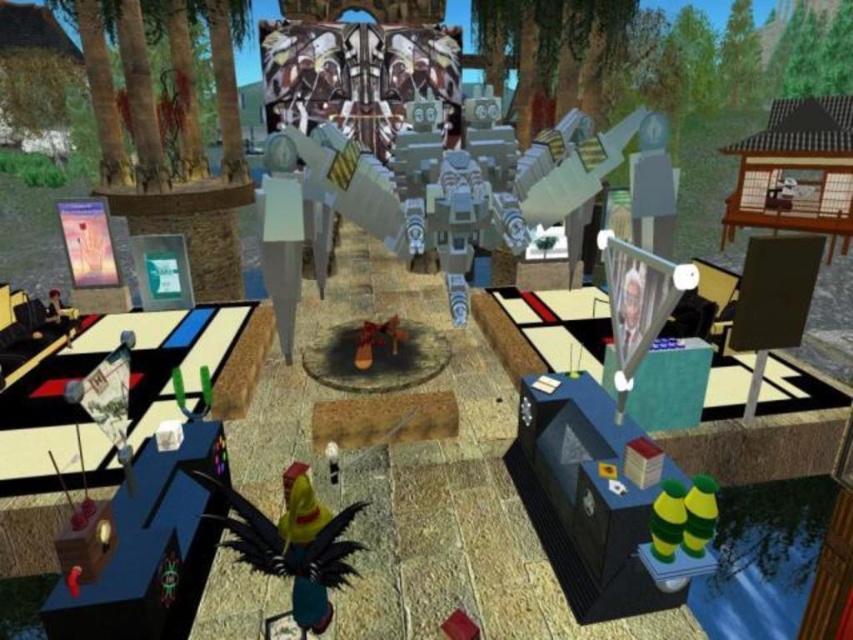
Question: Which is farther from the shiny yellow toy at center?

Choices:
 (A) metallic silver frame at upper right
 (B) metallic silver poster at left

Answer: (B)

Question: Which object appears closest to the camera in this image?

Choices:
 (A) metallic silver frame at upper right
 (B) shiny yellow toy at center

Answer: (B)

Question: Can you confirm if metallic silver frame at upper right is bigger than metallic silver poster at left?

Choices:
 (A) no
 (B) yes

Answer: (A)

Question: Which point is farther from the camera taking this photo?

Choices:
 (A) (643, 260)
 (B) (79, 211)
 (C) (299, 604)

Answer: (B)

Question: Is shiny yellow toy at center bigger than metallic silver frame at upper right?

Choices:
 (A) no
 (B) yes

Answer: (B)

Question: Observing the image, what is the correct spatial positioning of shiny yellow toy at center in reference to metallic silver poster at left?

Choices:
 (A) left
 (B) right

Answer: (B)